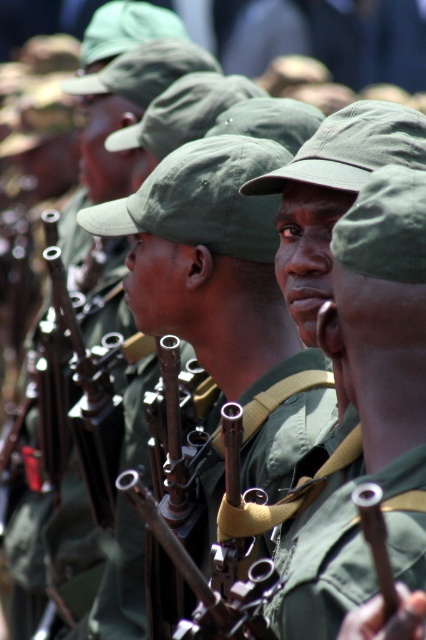
You are a photographer standing at the point marked by the coordinate point (363,397). Looking towards the matte green uniform at center, which direction should you face to ensure the matte green uniform at center is in your camera frame?

The point marked by the coordinate point (363,397) is directly at the matte green uniform at center, so you are already facing it. No adjustment is needed.

You are a military inspector checking the soldiers in formation. You notice two uniforms at the center of the formation labeled as matte green uniform at center and green fabric uniform at center. Which uniform has a greater width?

The matte green uniform at center has a greater width than the green fabric uniform at center according to the description.

Looking at this image, you are a photographer positioned at the origin point. You want to take a photo of the matte green uniform at center. What are the coordinates where you should aim your camera?

The matte green uniform at center is located at point coordinates of [363,397]. You should aim your camera at those coordinates to capture the matte green uniform at center.